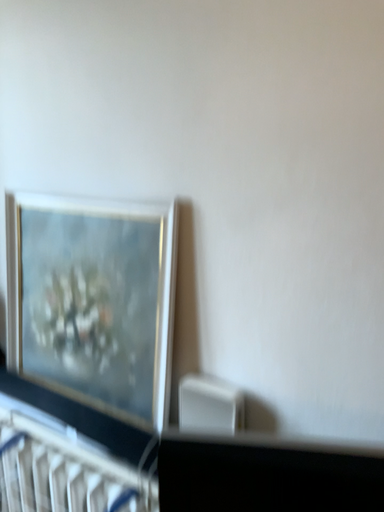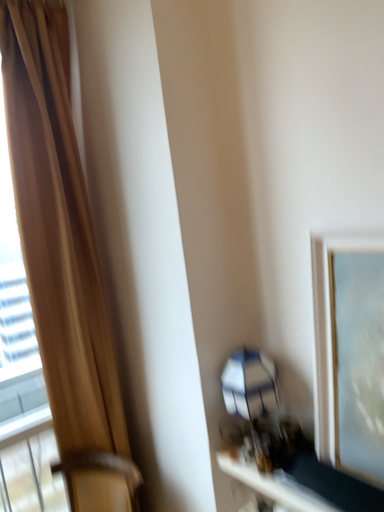
Question: How did the camera likely rotate when shooting the video?

Choices:
 (A) rotated left
 (B) rotated right

Answer: (A)